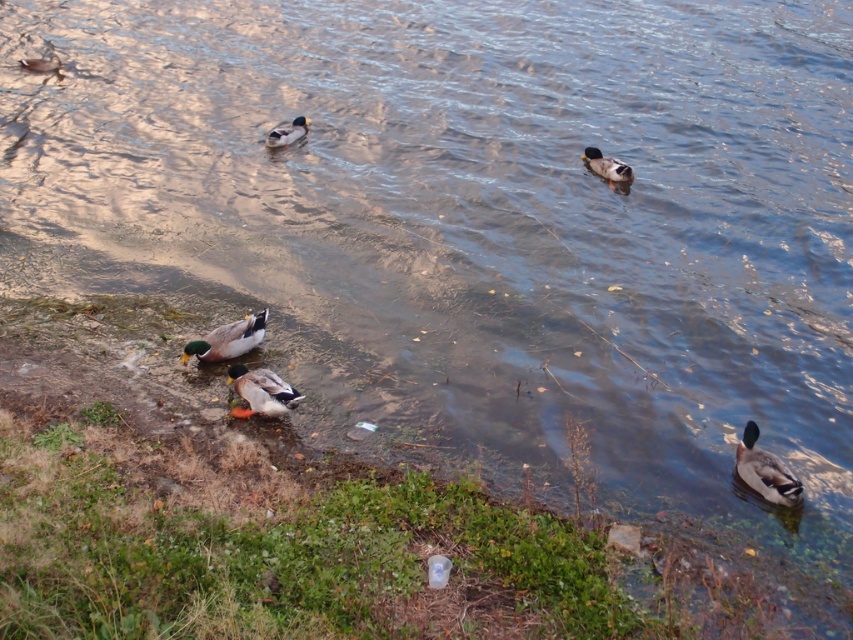
Question: Among these points, which one is nearest to the camera?

Choices:
 (A) (233, 342)
 (B) (787, 486)
 (C) (286, 131)

Answer: (B)

Question: Can you confirm if green glossy duck at upper right is positioned to the left of matte gray duck at upper left?

Choices:
 (A) yes
 (B) no

Answer: (B)

Question: Is green glossy duck at upper right further to the viewer compared to green matte duck at upper center?

Choices:
 (A) yes
 (B) no

Answer: (B)

Question: Which point is farther to the camera?

Choices:
 (A) (286, 124)
 (B) (28, 60)

Answer: (B)

Question: Considering the real-world distances, which object is farthest from the greenish-brown feathers duck at lower right?

Choices:
 (A) matte gray duck at center
 (B) green glossy duck at upper right

Answer: (B)

Question: From the image, what is the correct spatial relationship of green glossy duck at lower left in relation to matte gray duck at upper left?

Choices:
 (A) left
 (B) right

Answer: (B)